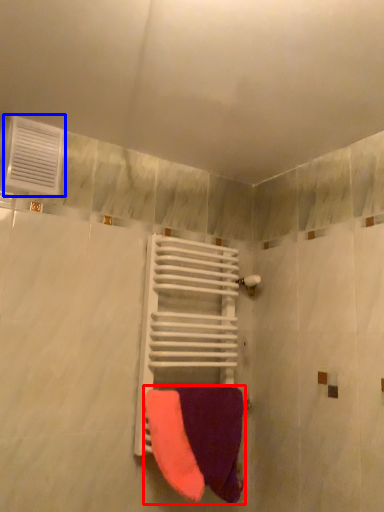
Question: Which object appears farthest to the camera in this image, towel (highlighted by a red box) or air conditioning (highlighted by a blue box)?

Choices:
 (A) towel
 (B) air conditioning

Answer: (B)